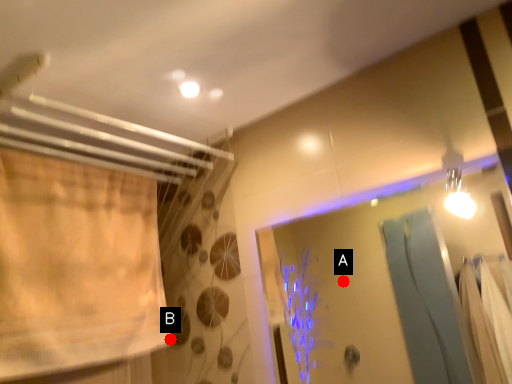
Question: Two points are circled on the image, labeled by A and B beside each circle. Which point is farther to the camera?

Choices:
 (A) A is further
 (B) B is further

Answer: (A)